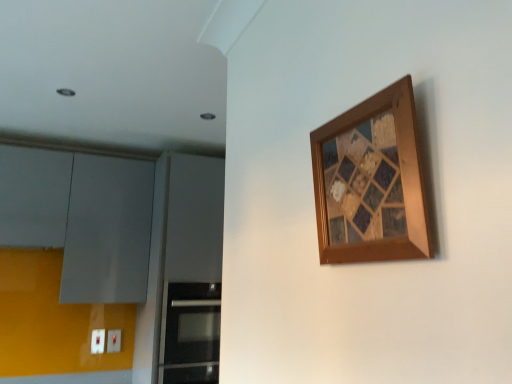
This screenshot has height=384, width=512. What do you see at coordinates (371, 182) in the screenshot?
I see `wooden mosaic art at upper right` at bounding box center [371, 182].

Locate an element on the screen. The height and width of the screenshot is (384, 512). wooden mosaic art at upper right is located at coordinates (371, 182).

The height and width of the screenshot is (384, 512). I want to click on wooden mosaic art at upper right, so click(x=371, y=182).